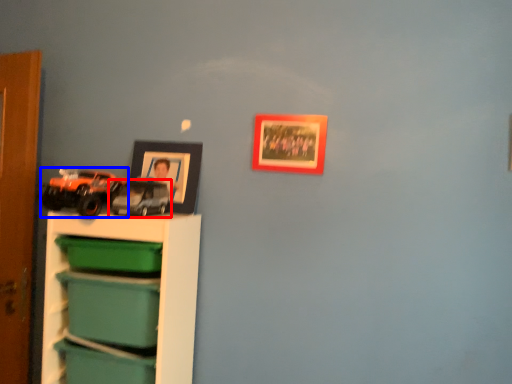
Question: Which object appears closest to the camera in this image, toy (highlighted by a red box) or toy (highlighted by a blue box)?

Choices:
 (A) toy
 (B) toy

Answer: (B)